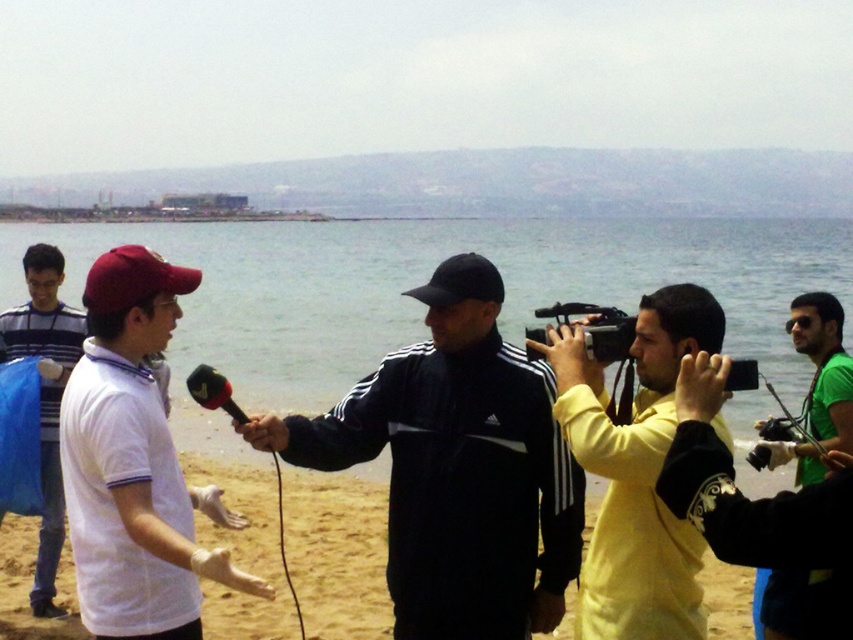
Question: Which point appears closest to the camera in this image?

Choices:
 (A) (276, 417)
 (B) (189, 627)

Answer: (B)

Question: Which of the following is the closest to the observer?

Choices:
 (A) black matte jacket at center
 (B) matte black camera at center
 (C) green matte shirt at right

Answer: (B)

Question: Among these points, which one is farthest from the camera?

Choices:
 (A) (202, 400)
 (B) (73, 364)
 (C) (88, 586)
 (D) (515, 566)

Answer: (B)

Question: Does black matte jacket at center appear on the left side of yellow fleece jacket at center?

Choices:
 (A) no
 (B) yes

Answer: (B)

Question: In this image, where is yellow fleece jacket at center located relative to black matte microphone at center?

Choices:
 (A) left
 (B) right

Answer: (B)

Question: From the image, what is the correct spatial relationship of green matte shirt at right in relation to striped cotton shirt at left?

Choices:
 (A) below
 (B) above

Answer: (B)